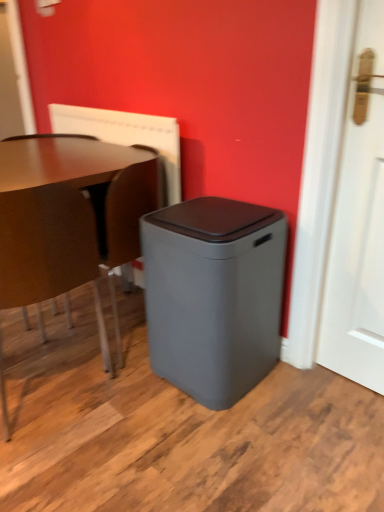
Locate an element on the screen. This screenshot has width=384, height=512. free space to the left of white matte door at right is located at coordinates (309, 390).